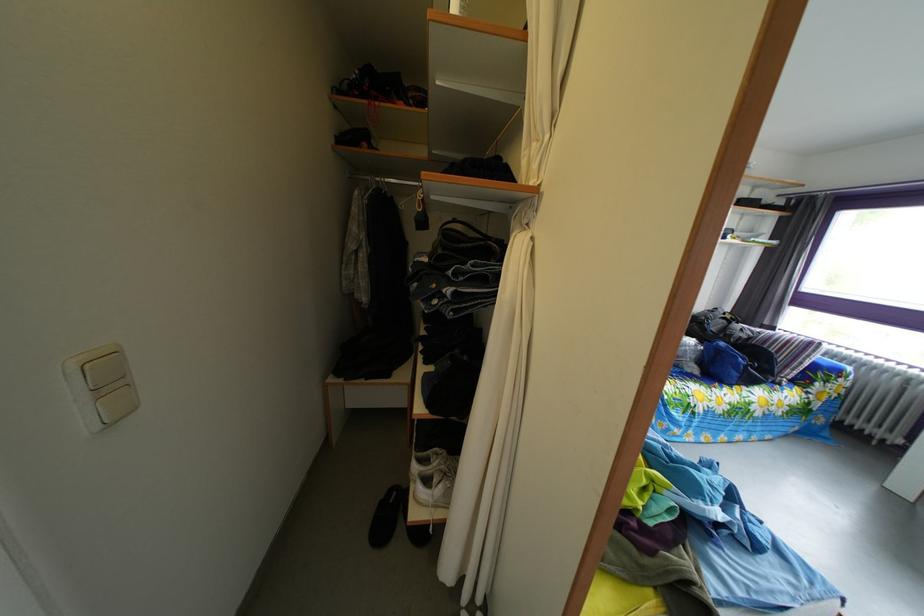
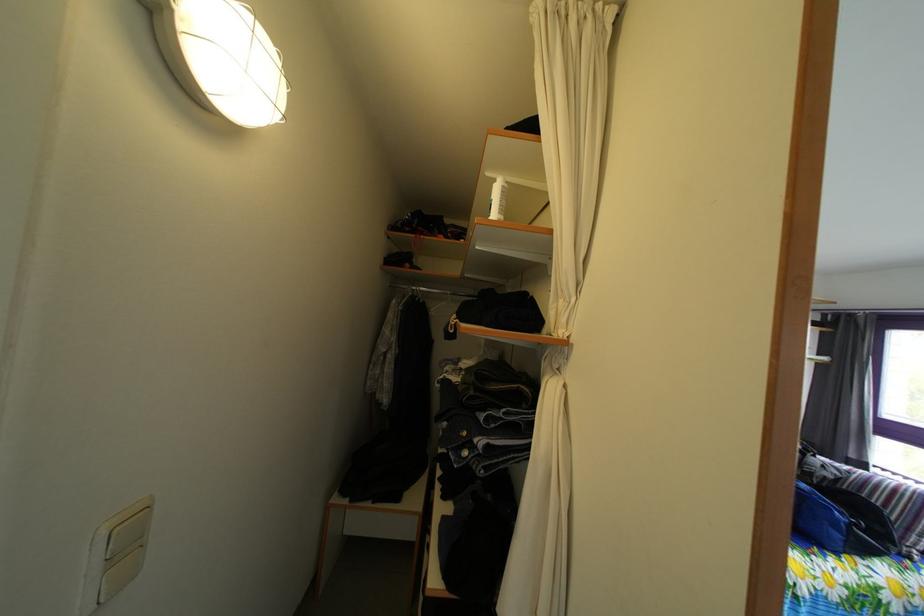
Find the pixel in the second image that matches the point at 514,270 in the first image.

(545, 416)